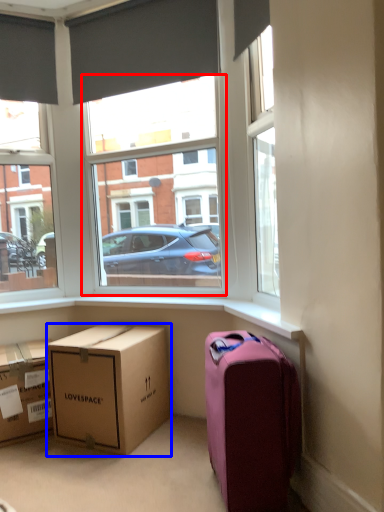
Question: Which object appears farthest to the camera in this image, window frame (highlighted by a red box) or box (highlighted by a blue box)?

Choices:
 (A) window frame
 (B) box

Answer: (A)